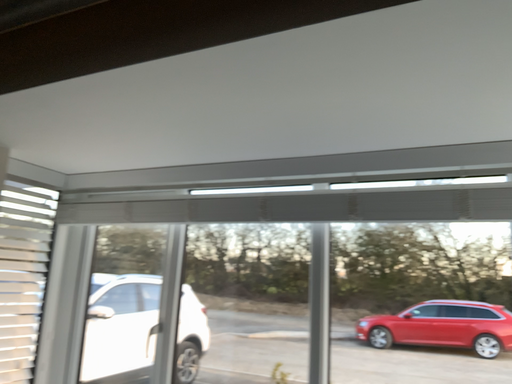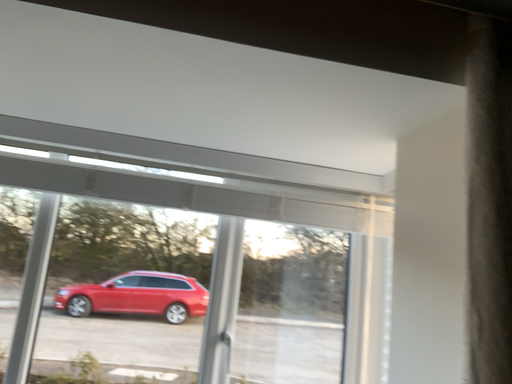
Question: How did the camera likely rotate when shooting the video?

Choices:
 (A) rotated upward
 (B) rotated downward

Answer: (B)